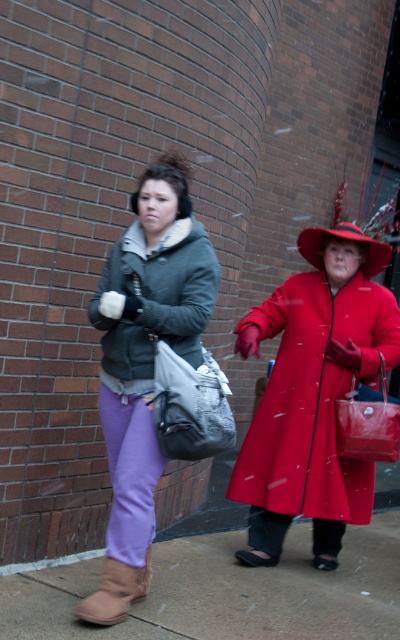
You are a photographer trying to capture a photo of the matte gray coat at center and the gray fabric shopping bag at center. Which object should you focus on first if you want to ensure both are in focus without adjusting your camera settings?

The matte gray coat at center is above the gray fabric shopping bag at center, so focusing on the matte gray coat at center first will ensure both are in focus since it is closer to the camera.

You are a photographer standing in front of the sidewalk scene. You want to take a closeup shot of the shiny red leather handbag at center without including the brown suede boot at lower left in the frame. Is this possible based on their positions?

Yes, the shiny red leather handbag at center is further to the viewer than the brown suede boot at lower left, so you can adjust the camera angle to focus on the handbag while excluding the boot from the frame.

You are a delivery robot with a 10 inch wide package. You need to navigate between the matte gray coat at center and the gray fabric shopping bag at center. Can you fit through the space between them?

The matte gray coat at center is 9.71 inches away from the gray fabric shopping bag at center. Since the distance between them is less than the 10 inch width of the package, the robot cannot fit through the space between them.